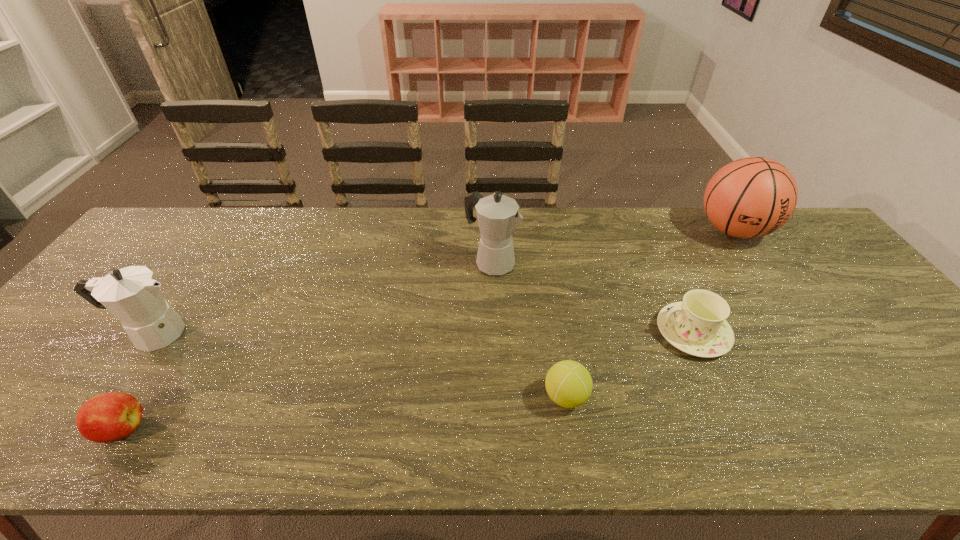
I want to click on the third object from left to right, so click(x=498, y=217).

The image size is (960, 540). Identify the location of the right coffeepot. (498, 217).

The image size is (960, 540). Find the location of `basketball`. basketball is located at coordinates tap(751, 197).

This screenshot has width=960, height=540. Find the location of `the left coffeepot`. the left coffeepot is located at coordinates (132, 294).

This screenshot has height=540, width=960. Find the location of `chinaware`. chinaware is located at coordinates (697, 326).

Where is `tennis ball`? This screenshot has width=960, height=540. tennis ball is located at coordinates (568, 383).

At what (x,y) coordinates should I click in order to perform the action: click on apple. Please return your answer as a coordinate pair (x, y). The width and height of the screenshot is (960, 540). Looking at the image, I should click on (109, 417).

You are a GUI agent. You are given a task and a screenshot of the screen. Output one action in this format:
    pyautogui.click(x=<x>, y=<y>)
    Task: Click on the vacant region located on the left of the right coffeepot
    The width and height of the screenshot is (960, 540).
    Given the screenshot: What is the action you would take?
    pyautogui.click(x=365, y=262)

Identify the location of vacant space located 0.180m on the surface of the rightmost object near the brand logo. pyautogui.click(x=780, y=298).

Locate an element on the screen. The image size is (960, 540). free space located 0.270m at the spout of the nearer coffeepot is located at coordinates (299, 333).